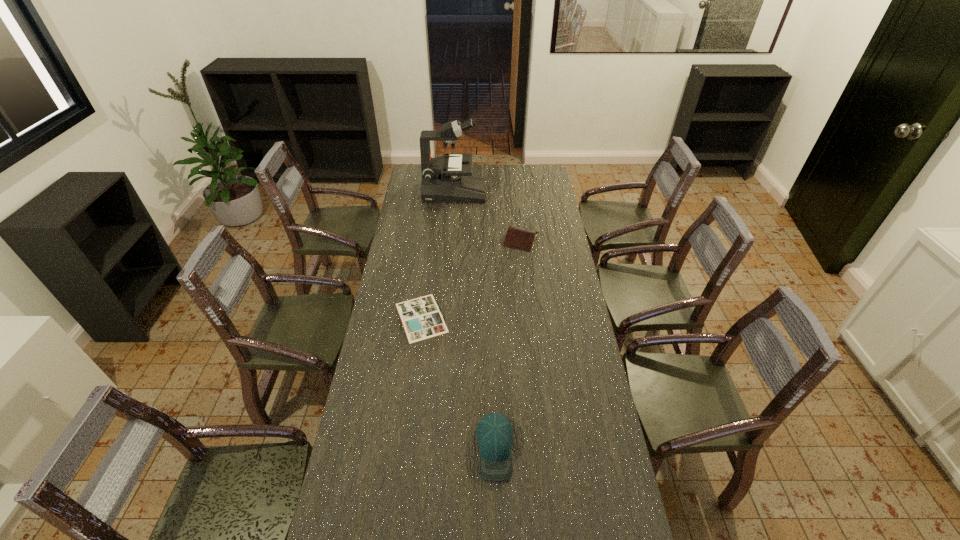
Find the location of a particular element. The width and height of the screenshot is (960, 540). free spot at the far right corner of the desktop is located at coordinates (539, 170).

What are the coordinates of `free space between the left book and the microscope` in the screenshot? It's located at (438, 255).

The image size is (960, 540). In order to click on free point between the tallest object and the nearest object in this screenshot , I will do `click(474, 321)`.

Locate an element on the screen. blank region between the nearest object and the third tallest object is located at coordinates (509, 343).

Locate an element on the screen. The height and width of the screenshot is (540, 960). vacant point located between the farthest object and the second tallest object is located at coordinates (474, 321).

I want to click on vacant area that lies between the second nearest object and the farther book, so [471, 278].

Locate an element on the screen. Image resolution: width=960 pixels, height=540 pixels. vacant area between the microscope and the second tallest object is located at coordinates (474, 321).

You are a GUI agent. You are given a task and a screenshot of the screen. Output one action in this format:
    pyautogui.click(x=<x>, y=<y>)
    Task: Click on the free space between the third farthest object and the farther book
    Image resolution: width=960 pixels, height=540 pixels.
    Given the screenshot: What is the action you would take?
    pos(471,278)

Where is `free point between the baseball cap and the farther book`? This screenshot has width=960, height=540. free point between the baseball cap and the farther book is located at coordinates (509, 343).

You are a GUI agent. You are given a task and a screenshot of the screen. Output one action in this format:
    pyautogui.click(x=<x>, y=<y>)
    Task: Click on the free space between the farthest object and the baseball cap
    Image resolution: width=960 pixels, height=540 pixels.
    Given the screenshot: What is the action you would take?
    pyautogui.click(x=474, y=321)